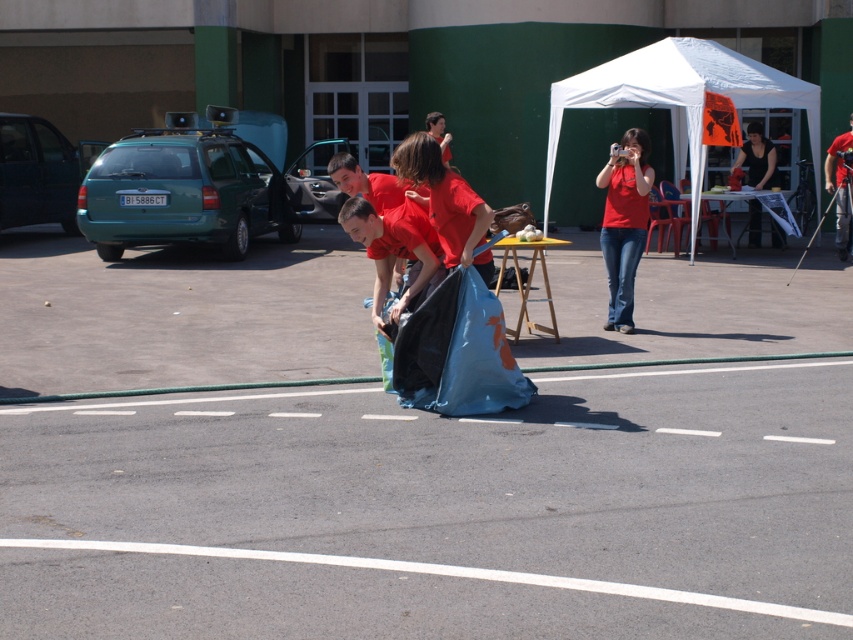
Question: Which of these objects is positioned farthest from the matte red shirt at upper right?

Choices:
 (A) matte red shirt at center
 (B) smooth red shirt at center

Answer: (B)

Question: Considering the real-world distances, which object is farthest from the matte red shirt at upper right?

Choices:
 (A) matte red shirt at center
 (B) white fabric tent at upper right
 (C) black fabric shirt at upper right
 (D) smooth red shirt at center

Answer: (C)

Question: Does matte red shirt at upper right have a smaller size compared to matte red shirt at center?

Choices:
 (A) yes
 (B) no

Answer: (B)

Question: Which point is closer to the camera taking this photo?

Choices:
 (A) (436, 140)
 (B) (750, 132)

Answer: (A)

Question: Is matte red shirt at upper right below smooth red shirt at center?

Choices:
 (A) yes
 (B) no

Answer: (A)

Question: Does matte red shirt at center have a lesser width compared to smooth red shirt at center?

Choices:
 (A) no
 (B) yes

Answer: (A)